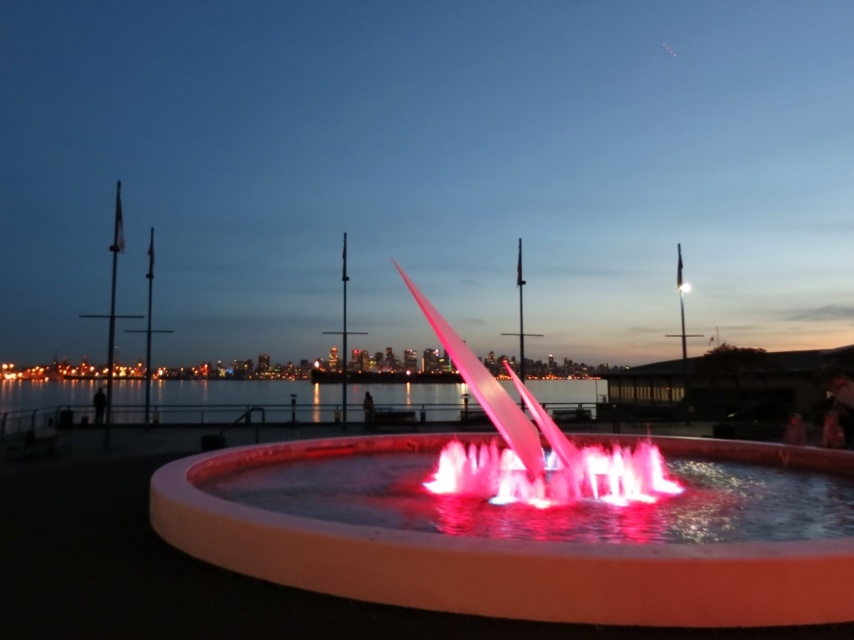
You are standing at the waterfront and want to take a photo of the matte pink fountain at center. If your camera has a maximum focus range of 4 meters, will it be able to capture the fountain clearly?

The matte pink fountain at center is 3.94 meters away from the viewer. Since the camera can focus up to 4 meters, it will be able to capture the fountain clearly within the focus range.

You are standing at the waterfront looking at the fountain and the city lights. There are two points marked in the image. Which point, point (431, 609) or point (115, 397), is closer to you?

Point (431, 609) is closer to you than point (115, 397).

You are standing at the edge of the waterfront and see the matte pink fountain at center and the transparent water at center. Which object is positioned to the left?

The transparent water at center is to the left of the matte pink fountain at center.